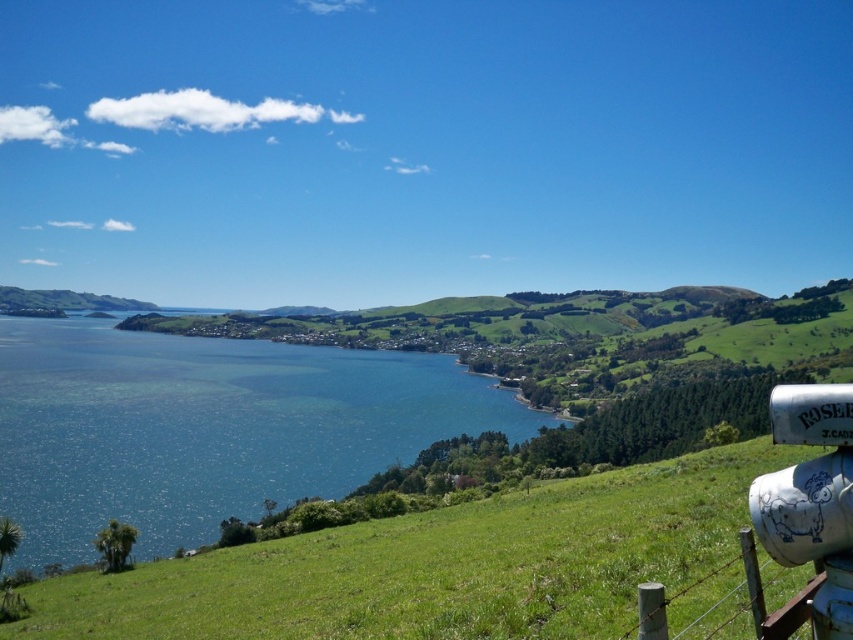
Can you confirm if green grassy hillside at lower right is taller than blue water at center?

No, green grassy hillside at lower right is not taller than blue water at center.

Is point (305, 600) closer to viewer compared to point (143, 349)?

Yes, it is in front of point (143, 349).

Where is `green grassy hillside at lower right`? The height and width of the screenshot is (640, 853). green grassy hillside at lower right is located at coordinates (439, 564).